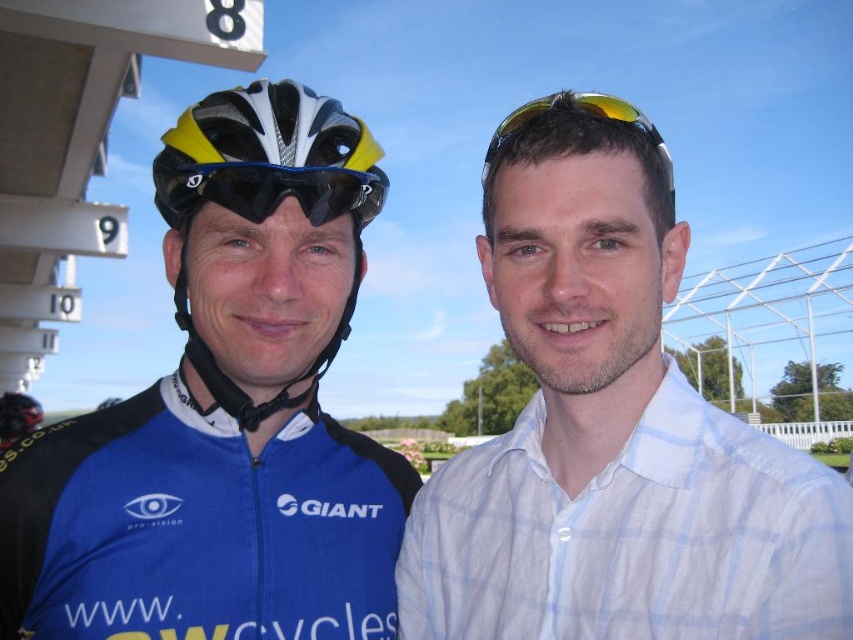
Which is below, white checkered shirt at center or black matte/glossy goggles at upper center?

white checkered shirt at center is below.

Between point (525, 323) and point (177, 227), which one is positioned behind?

Point (525, 323)

The height and width of the screenshot is (640, 853). I want to click on white checkered shirt at center, so click(x=612, y=429).

Which is above, white checkered shirt at center or yellow reflective lens sunglasses at upper center?

yellow reflective lens sunglasses at upper center is higher up.

Is white checkered shirt at center bigger than yellow reflective lens sunglasses at upper center?

Incorrect, white checkered shirt at center is not larger than yellow reflective lens sunglasses at upper center.

The width and height of the screenshot is (853, 640). What are the coordinates of `white checkered shirt at center` in the screenshot? It's located at (612, 429).

Is white checkered shirt at center above matte black helmet at left?

Indeed, white checkered shirt at center is positioned over matte black helmet at left.

Who is taller, white checkered shirt at center or matte black helmet at left?

Standing taller between the two is matte black helmet at left.

You are a GUI agent. You are given a task and a screenshot of the screen. Output one action in this format:
    pyautogui.click(x=<x>, y=<y>)
    Task: Click on the white checkered shirt at center
    The width and height of the screenshot is (853, 640).
    Given the screenshot: What is the action you would take?
    pyautogui.click(x=612, y=429)

Identify the location of white checkered shirt at center. (612, 429).